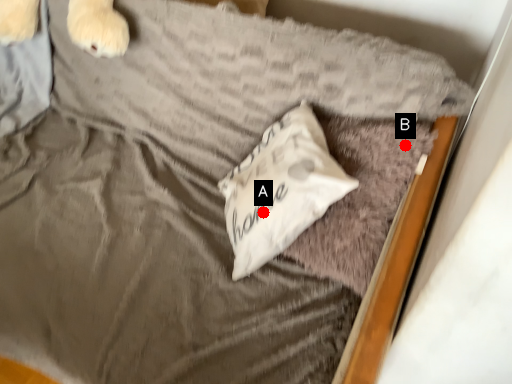
Question: Two points are circled on the image, labeled by A and B beside each circle. Among these points, which one is nearest to the camera?

Choices:
 (A) A is closer
 (B) B is closer

Answer: (B)